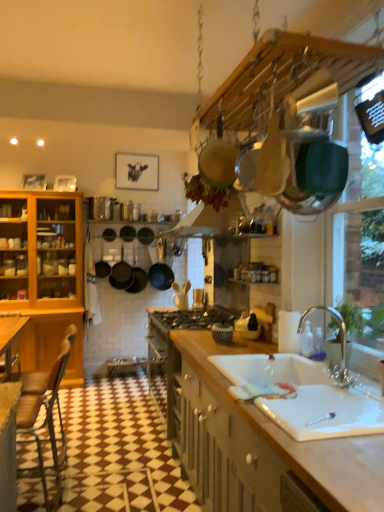
Question: From the image's perspective, is black matte frying pan at center above white wood countertop at lower right?

Choices:
 (A) no
 (B) yes

Answer: (B)

Question: Does black matte frying pan at center have a greater width compared to white wood countertop at lower right?

Choices:
 (A) no
 (B) yes

Answer: (A)

Question: From the image's perspective, is black matte frying pan at center under white wood countertop at lower right?

Choices:
 (A) no
 (B) yes

Answer: (A)

Question: Is black matte frying pan at center further to camera compared to white wood countertop at lower right?

Choices:
 (A) no
 (B) yes

Answer: (B)

Question: Does black matte frying pan at center appear on the right side of white wood countertop at lower right?

Choices:
 (A) yes
 (B) no

Answer: (B)

Question: Can you confirm if black matte frying pan at center is shorter than white wood countertop at lower right?

Choices:
 (A) no
 (B) yes

Answer: (B)

Question: From the image's perspective, is black matte frying pan at center on top of chrome metallic faucet at sink right?

Choices:
 (A) yes
 (B) no

Answer: (A)

Question: Does black matte frying pan at center have a greater height compared to chrome metallic faucet at sink right?

Choices:
 (A) yes
 (B) no

Answer: (A)

Question: Is black matte frying pan at center not inside chrome metallic faucet at sink right?

Choices:
 (A) no
 (B) yes

Answer: (B)

Question: Is black matte frying pan at center bigger than chrome metallic faucet at sink right?

Choices:
 (A) no
 (B) yes

Answer: (B)

Question: Considering the relative sizes of black matte frying pan at center and chrome metallic faucet at sink right in the image provided, is black matte frying pan at center thinner than chrome metallic faucet at sink right?

Choices:
 (A) yes
 (B) no

Answer: (B)

Question: Considering the relative sizes of black matte frying pan at center and chrome metallic faucet at sink right in the image provided, is black matte frying pan at center wider than chrome metallic faucet at sink right?

Choices:
 (A) no
 (B) yes

Answer: (B)

Question: From the image's perspective, would you say brown leather chair at lower left is shown under chrome metallic faucet at sink right?

Choices:
 (A) yes
 (B) no

Answer: (A)